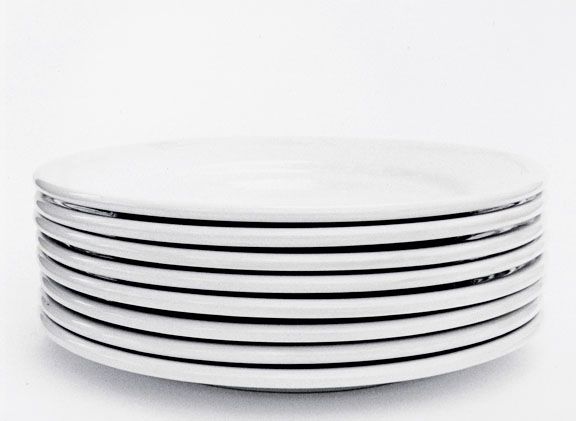
This screenshot has height=421, width=576. Identify the location of plate. (191, 377), (209, 351), (209, 334), (216, 306), (222, 281), (225, 261), (228, 239), (229, 215).